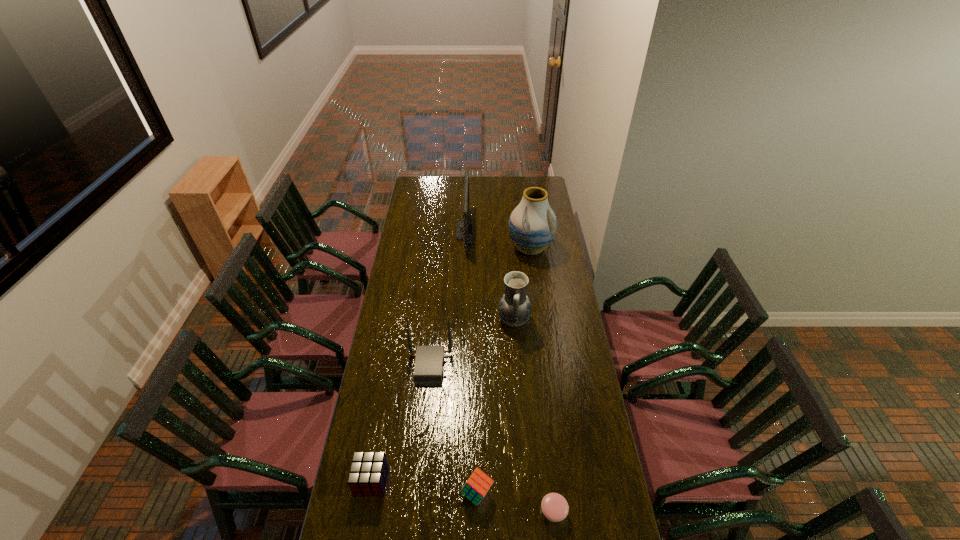
The width and height of the screenshot is (960, 540). I want to click on the tallest object, so click(532, 225).

Find the location of a particular element. This screenshot has height=540, width=960. monitor is located at coordinates (464, 227).

Locate an element on the screen. pitcher is located at coordinates (514, 308).

The height and width of the screenshot is (540, 960). Identify the location of the fourth shortest object. (428, 370).

I want to click on router, so coord(428,370).

At what (x,y) coordinates should I click in order to perform the action: click on the left cube. Please return your answer as a coordinate pair (x, y). Image resolution: width=960 pixels, height=540 pixels. Looking at the image, I should click on (368, 473).

The image size is (960, 540). What are the coordinates of `the right cube` in the screenshot? It's located at (x=476, y=487).

The image size is (960, 540). I want to click on the shortest object, so click(x=555, y=508).

The image size is (960, 540). Identify the location of blank space located on the left of the tallest object. (455, 248).

Locate an element on the screen. The image size is (960, 540). vacant space located 0.200m on the screen side of the monitor is located at coordinates (506, 231).